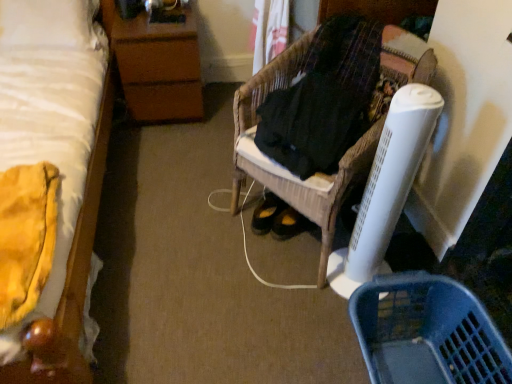
The image size is (512, 384). I want to click on free space to the left of blue plastic basket at lower right, so click(286, 331).